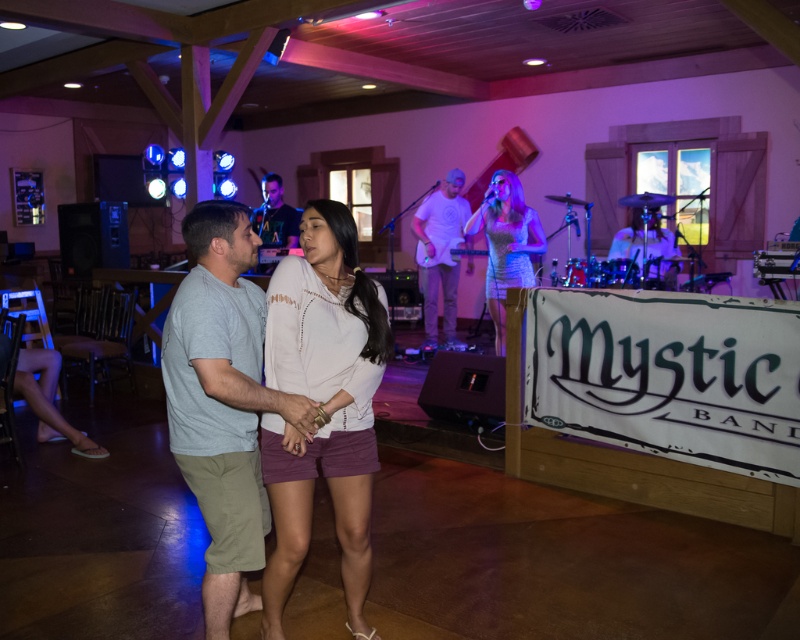
Question: Which point is farther to the camera?

Choices:
 (A) white matte shirt at center
 (B) matte white shirt at center
 (C) matte black shirt at center

Answer: (B)

Question: Is white matte shirt at center to the left of light gray cotton t-shirt at center from the viewer's perspective?

Choices:
 (A) yes
 (B) no

Answer: (B)

Question: Is light gray cotton t-shirt at center closer to camera compared to shiny silver dress at center?

Choices:
 (A) no
 (B) yes

Answer: (B)

Question: Which of the following is the closest to the observer?

Choices:
 (A) matte black shirt at center
 (B) light gray cotton t-shirt at center
 (C) matte white shirt at center
 (D) white matte shirt at center

Answer: (B)

Question: Can you confirm if matte white shirt at center is positioned to the left of matte black shirt at center?

Choices:
 (A) yes
 (B) no

Answer: (B)

Question: Estimate the real-world distances between objects in this image. Which object is closer to the matte black shirt at center?

Choices:
 (A) shiny silver dress at center
 (B) light gray cotton t-shirt at center

Answer: (A)